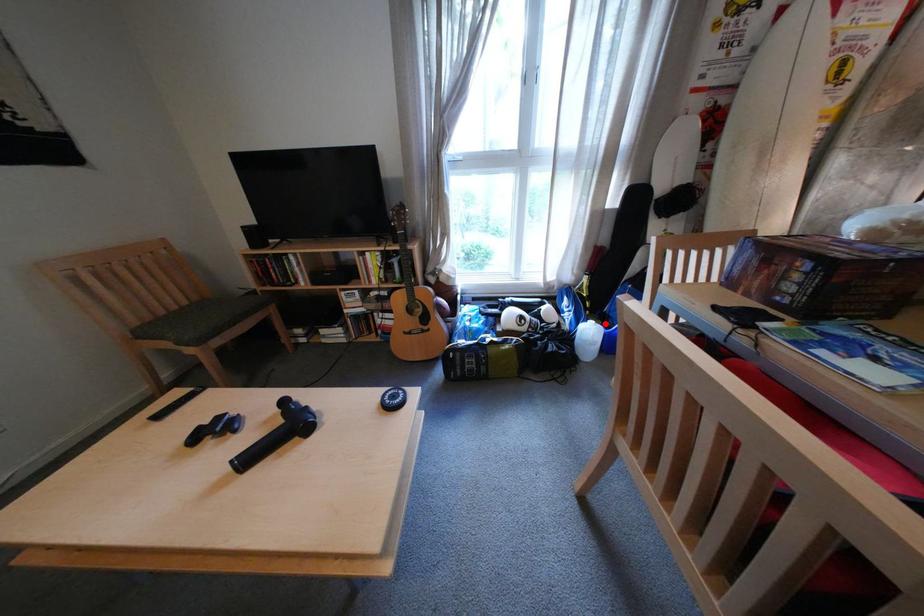
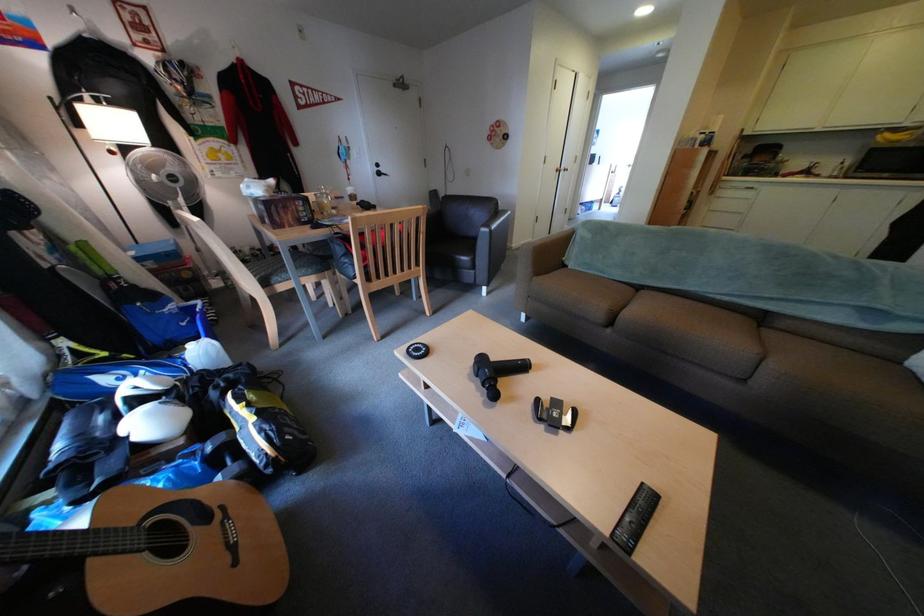
Question: I am providing you with two images of the same scene from different viewpoints. Image1 has a red point marked. In image2, the corresponding 3D location appears at what relative position? Reply with the corresponding letter.

Choices:
 (A) Closer
 (B) Farther

Answer: (B)